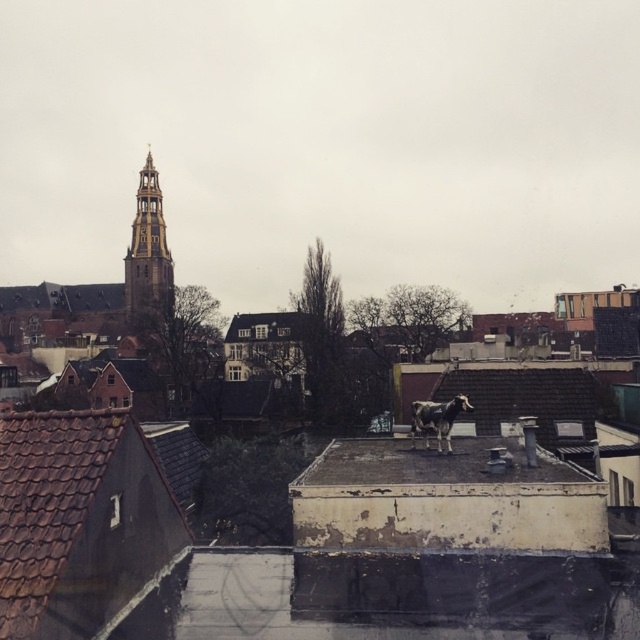
Question: Can you confirm if rusty metal roof at center is positioned below golden wood tower at upper left?

Choices:
 (A) no
 (B) yes

Answer: (B)

Question: Which point is farther to the camera?

Choices:
 (A) (448, 433)
 (B) (134, 305)

Answer: (B)

Question: Based on their relative distances, which object is farther from the rusty metal roof at center?

Choices:
 (A) golden wood tower at upper left
 (B) white glossy cow at center

Answer: (A)

Question: Does rusty metal roof at center lie behind white glossy cow at center?

Choices:
 (A) no
 (B) yes

Answer: (A)

Question: Which object is closer to the camera taking this photo?

Choices:
 (A) white glossy cow at center
 (B) golden wood tower at upper left

Answer: (A)

Question: Is rusty metal roof at center to the left of white glossy cow at center from the viewer's perspective?

Choices:
 (A) yes
 (B) no

Answer: (A)